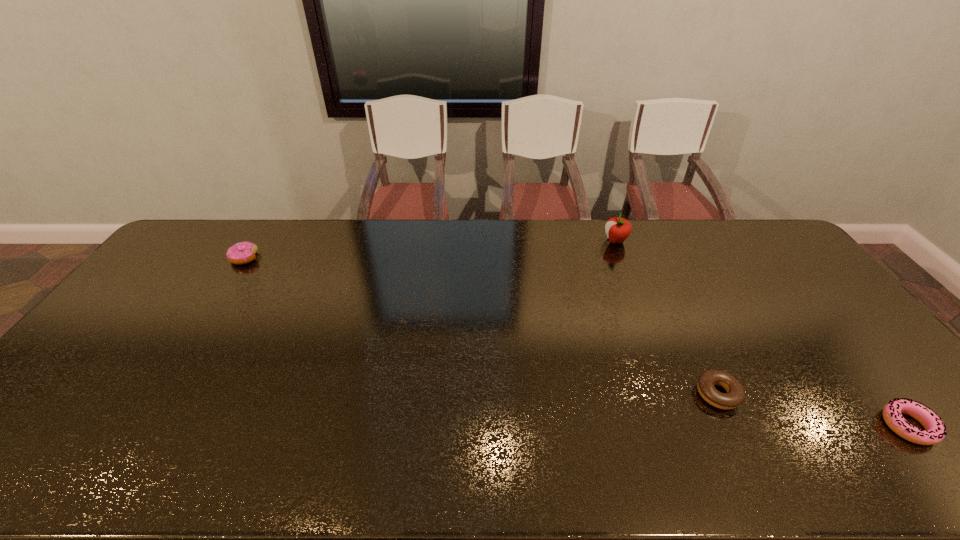
You are a GUI agent. You are given a task and a screenshot of the screen. Output one action in this format:
    pyautogui.click(x=<x>, y=<y>)
    Task: Click on the blank region between the leftmost doughnut and the tallest object
    This screenshot has height=540, width=960.
    Given the screenshot: What is the action you would take?
    pyautogui.click(x=430, y=249)

Point out which object is positioned as the nearest to the second doughnut from left to right. Please provide its 2D coordinates. Your answer should be formatted as a tuple, i.e. [(x, y)], where the tuple contains the x and y coordinates of a point satisfying the conditions above.

[(935, 430)]

This screenshot has width=960, height=540. Find the location of `object that is the closest to the apple`. object that is the closest to the apple is located at coordinates (735, 396).

The image size is (960, 540). Find the location of `doughnut that is the closest to the rightmost object`. doughnut that is the closest to the rightmost object is located at coordinates (735, 396).

Choose which doughnut is the third nearest neighbor to the tallest object. Please provide its 2D coordinates. Your answer should be formatted as a tuple, i.e. [(x, y)], where the tuple contains the x and y coordinates of a point satisfying the conditions above.

[(240, 253)]

The width and height of the screenshot is (960, 540). I want to click on blank space that satisfies the following two spatial constraints: 1. on the front side of the second object from left to right; 2. on the left side of the rightmost object, so click(687, 426).

Where is `free space that satisfies the following two spatial constraints: 1. on the front side of the rightmost object; 2. on the left side of the farthest object`? This screenshot has height=540, width=960. free space that satisfies the following two spatial constraints: 1. on the front side of the rightmost object; 2. on the left side of the farthest object is located at coordinates (687, 426).

The width and height of the screenshot is (960, 540). I want to click on blank area in the image that satisfies the following two spatial constraints: 1. on the front side of the third object from right to left; 2. on the right side of the rightmost doughnut, so click(x=687, y=426).

Where is `blank area in the image that satisfies the following two spatial constraints: 1. on the front side of the farthest doughnut; 2. on the right side of the rightmost object`? This screenshot has width=960, height=540. blank area in the image that satisfies the following two spatial constraints: 1. on the front side of the farthest doughnut; 2. on the right side of the rightmost object is located at coordinates (136, 426).